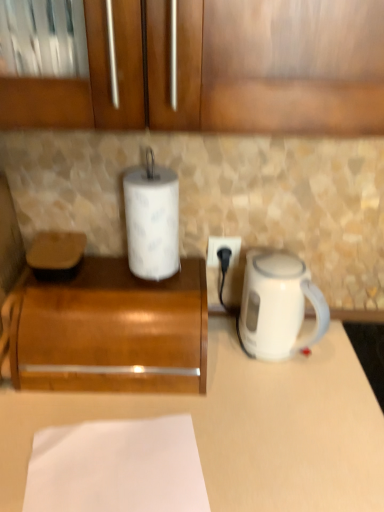
Find the location of a particular element. Image resolution: width=384 pixels, height=512 pixels. free location in front of white glossy electric kettle at right is located at coordinates (288, 407).